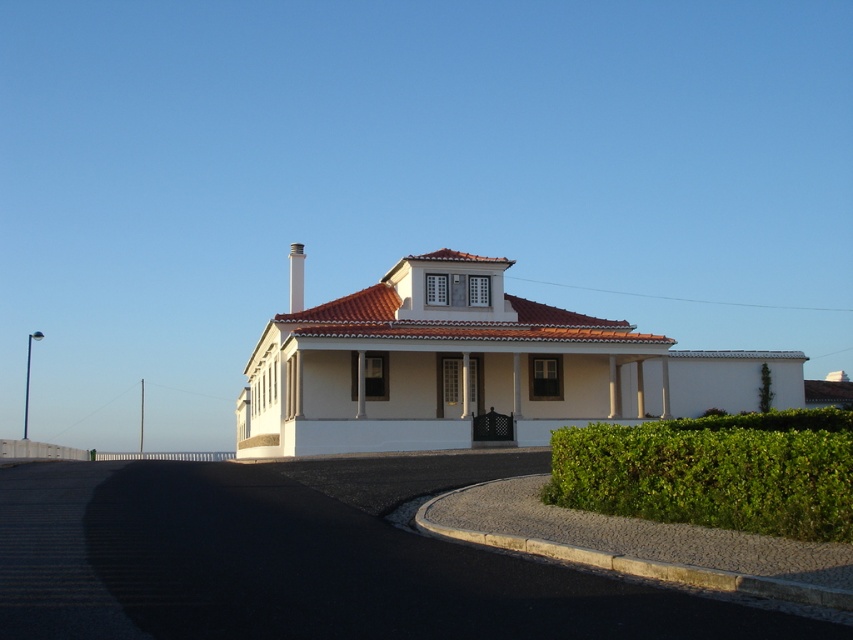
You are a landscape architect designing a garden around the building. You have a path that needs to be placed between the green leafy hedge at lower right and the white smooth chimney at center. Considering their thickness, which object should the path be closer to?

The path should be closer to the green leafy hedge at lower right because it is thinner than the white smooth chimney at center, allowing more space around the wider chimney.